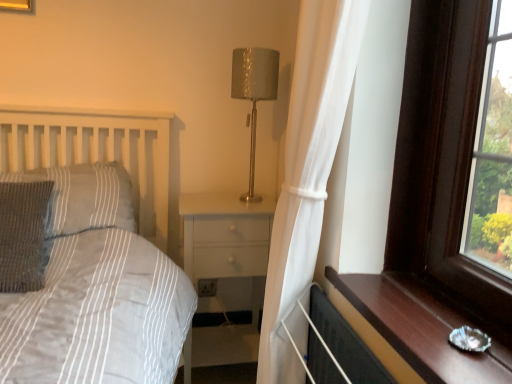
Question: Considering the relative positions of knitted fabric pillow at left, the 1th pillow when ordered from back to front, and brown wooden window sill at right in the image provided, is knitted fabric pillow at left, the 1th pillow when ordered from back to front, to the right of brown wooden window sill at right from the viewer's perspective?

Choices:
 (A) no
 (B) yes

Answer: (A)

Question: Is knitted fabric pillow at left, the 1th pillow when ordered from back to front, positioned far away from brown wooden window sill at right?

Choices:
 (A) yes
 (B) no

Answer: (B)

Question: Does knitted fabric pillow at left, positioned as the second pillow in front-to-back order, turn towards brown wooden window sill at right?

Choices:
 (A) yes
 (B) no

Answer: (B)

Question: Does knitted fabric pillow at left, positioned as the second pillow in front-to-back order, have a smaller size compared to brown wooden window sill at right?

Choices:
 (A) no
 (B) yes

Answer: (A)

Question: Is knitted fabric pillow at left, positioned as the second pillow in front-to-back order, closer to camera compared to brown wooden window sill at right?

Choices:
 (A) no
 (B) yes

Answer: (A)

Question: Does knitted fabric pillow at left, the 1th pillow when ordered from back to front, have a greater height compared to brown wooden window sill at right?

Choices:
 (A) no
 (B) yes

Answer: (B)

Question: Is knitted fabric pillow at left, positioned as the second pillow in front-to-back order, to the right of metallic gold table lamp at center from the viewer's perspective?

Choices:
 (A) yes
 (B) no

Answer: (B)

Question: From the image's perspective, is knitted fabric pillow at left, positioned as the second pillow in front-to-back order, located above metallic gold table lamp at center?

Choices:
 (A) yes
 (B) no

Answer: (B)

Question: Is knitted fabric pillow at left, positioned as the second pillow in front-to-back order, closer to the viewer compared to metallic gold table lamp at center?

Choices:
 (A) no
 (B) yes

Answer: (B)

Question: Does knitted fabric pillow at left, the 1th pillow when ordered from back to front, contain metallic gold table lamp at center?

Choices:
 (A) no
 (B) yes

Answer: (A)

Question: Considering the relative sizes of knitted fabric pillow at left, positioned as the second pillow in front-to-back order, and metallic gold table lamp at center in the image provided, is knitted fabric pillow at left, positioned as the second pillow in front-to-back order, bigger than metallic gold table lamp at center?

Choices:
 (A) no
 (B) yes

Answer: (B)

Question: Can you confirm if knitted fabric pillow at left, positioned as the second pillow in front-to-back order, is thinner than metallic gold table lamp at center?

Choices:
 (A) no
 (B) yes

Answer: (A)

Question: From the image's perspective, does knitted gray pillow at left, acting as the 1th pillow starting from the front, appear higher than metallic gold table lamp at center?

Choices:
 (A) no
 (B) yes

Answer: (A)